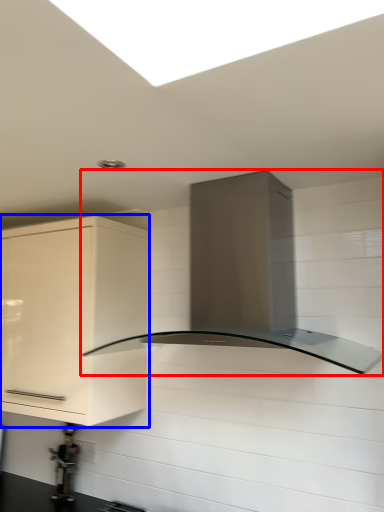
Question: Which of the following is the closest to the observer, home appliance (highlighted by a red box) or cabinetry (highlighted by a blue box)?

Choices:
 (A) home appliance
 (B) cabinetry

Answer: (A)